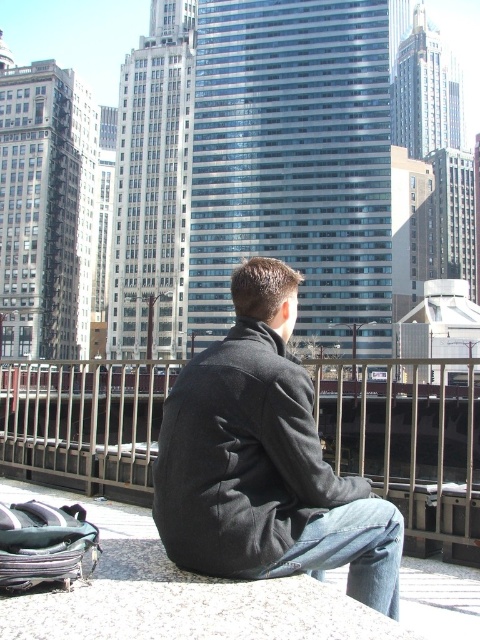
You are standing in the city scene and want to determine the distance between two points. The first point is at coordinates point (193, 365) and the second is at point (391, 536). Which point is closer to you?

Point (193, 365) is closer to you because it is further to the camera than point (391, 536).

You are a tailor who needs to compare the width of the dark gray wool coat at center and the denim at lower right to determine which requires more fabric. Based on the scene, which item is wider?

The dark gray wool coat at center is wider than the denim at lower right, so it requires more fabric.

Based on the photo, you are a delivery person trying to locate a package left at the center of the scene. You see the dark gray wool coat at center and the metallic silver rail at center. Which object is closer to the right side of the scene?

The dark gray wool coat at center is to the right of the metallic silver rail at center, so it is closer to the right side of the scene.